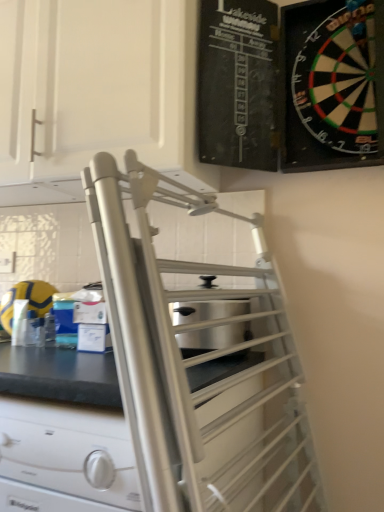
Question: From a real-world perspective, is satin silver drawer at center physically located above or below stainless steel toaster at center?

Choices:
 (A) below
 (B) above

Answer: (A)

Question: Looking at their shapes, would you say satin silver drawer at center is wider or thinner than stainless steel toaster at center?

Choices:
 (A) thin
 (B) wide

Answer: (B)

Question: Based on their relative distances, which object is nearer to the white matte cabinet at upper left, which is the 2th cabinetry from right to left?

Choices:
 (A) satin silver drawer at center
 (B) stainless steel toaster at center
 (C) black plastic dartboard at upper right, the first cabinetry positioned from the right

Answer: (C)

Question: Based on their relative distances, which object is farther from the black plastic dartboard at upper right, the first cabinetry positioned from the right?

Choices:
 (A) stainless steel toaster at center
 (B) white matte cabinet at upper left, which is the 2th cabinetry from right to left
 (C) satin silver drawer at center

Answer: (C)